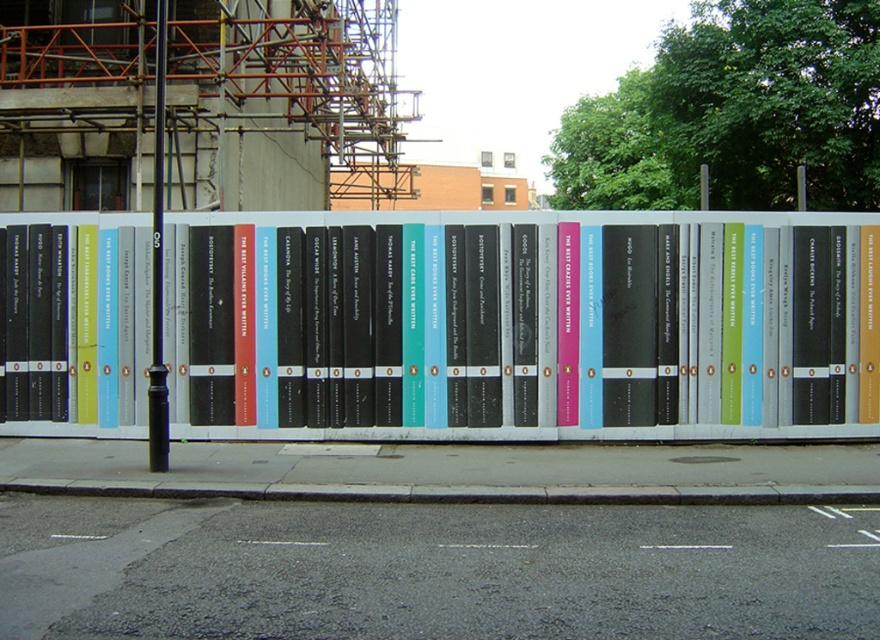
Question: Does gray concrete curb at lower center appear under black metal pole at center?

Choices:
 (A) yes
 (B) no

Answer: (A)

Question: Can you confirm if gray concrete curb at lower center is positioned below black metal pole at center?

Choices:
 (A) no
 (B) yes

Answer: (B)

Question: Can you confirm if metallic bookshelf at center is smaller than black metal pole at center?

Choices:
 (A) no
 (B) yes

Answer: (A)

Question: Which of the following is the closest to the observer?

Choices:
 (A) gray concrete curb at lower center
 (B) black metal pole at center
 (C) metallic bookshelf at center

Answer: (A)

Question: Estimate the real-world distances between objects in this image. Which object is farther from the black metal pole at center?

Choices:
 (A) metallic bookshelf at center
 (B) gray concrete curb at lower center

Answer: (B)

Question: Among these objects, which one is farthest from the camera?

Choices:
 (A) metallic bookshelf at center
 (B) gray concrete curb at lower center

Answer: (A)